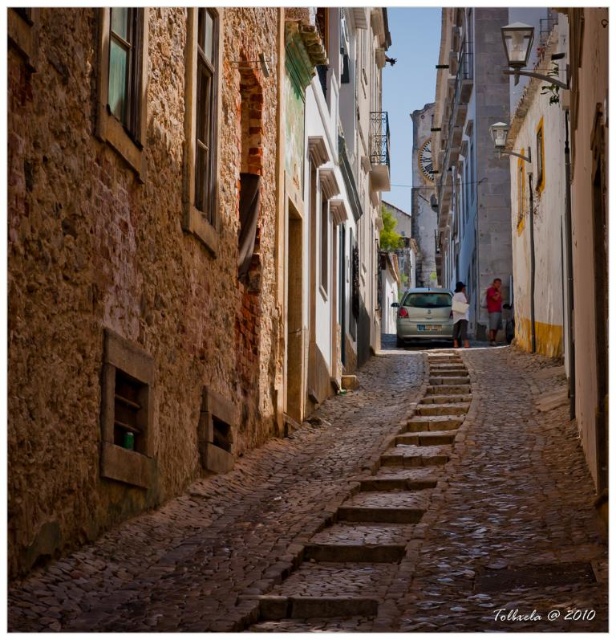
Question: Is brown cobblestone path at center wider than light beige metallic car at center?

Choices:
 (A) yes
 (B) no

Answer: (A)

Question: Does brown cobblestone stairs at center appear on the left side of light beige metallic car at center?

Choices:
 (A) yes
 (B) no

Answer: (A)

Question: Which point appears closest to the camera in this image?

Choices:
 (A) (333, 413)
 (B) (456, 378)
 (C) (415, 307)

Answer: (A)

Question: Which point is closer to the camera taking this photo?

Choices:
 (A) (411, 314)
 (B) (298, 566)
 (C) (527, 401)

Answer: (B)

Question: Which object is closer to the camera taking this photo?

Choices:
 (A) brown cobblestone stairs at center
 (B) light beige metallic car at center
 (C) brown cobblestone path at center

Answer: (C)

Question: Where is brown cobblestone path at center located in relation to brown cobblestone stairs at center in the image?

Choices:
 (A) left
 (B) right

Answer: (A)